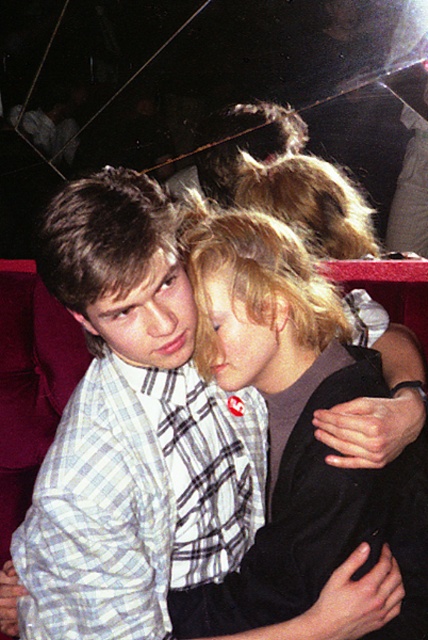
You are sitting in the front row of a theater and notice two people in the row ahead of you. You see the white checkered shirt at center and the blonde hair at center. Which one is closer to you?

The white checkered shirt at center is closer to the viewer than the blonde hair at center.

You are a photographer trying to capture a candid photo of two people sitting in a theater. The two people are wearing a white checkered shirt at center and a dark jacket over a gray top. The photographer wants to ensure there is enough space between them for a clear shot. Given that the minimum recommended distance for a clear photo is 30 inches, can the photographer proceed with the shot?

The two people are 36.10 inches apart, which exceeds the minimum recommended distance of 30 inches. The photographer can proceed with the shot as there is sufficient space between the white checkered shirt at center and the dark jacket over a gray top.

You are a photographer trying to capture a closeup shot of both the white checkered shirt at center and the blonde hair at center. Given that your camera can only focus on one subject at a time, which subject should you choose to ensure the smaller one is in focus?

The white checkered shirt at center is smaller than the blonde hair at center, so you should focus on the white checkered shirt at center to ensure it is in focus.